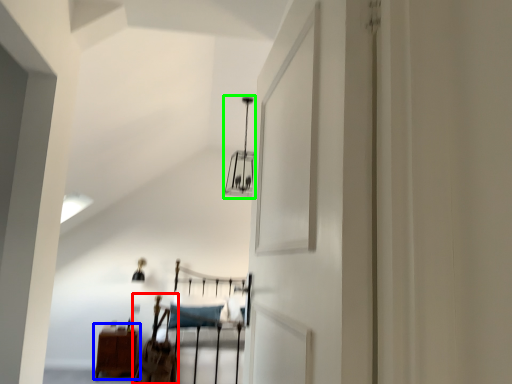
Question: Which is nearer to the chair (highlighted by a red box)? furniture (highlighted by a blue box) or light fixture (highlighted by a green box).

Choices:
 (A) furniture
 (B) light fixture

Answer: (A)